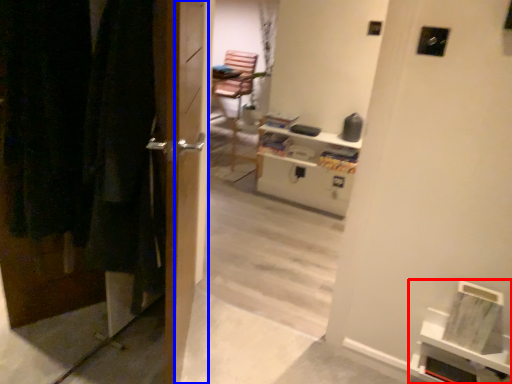
Question: Which object appears farthest to the camera in this image, shelf (highlighted by a red box) or screen door (highlighted by a blue box)?

Choices:
 (A) shelf
 (B) screen door

Answer: (A)